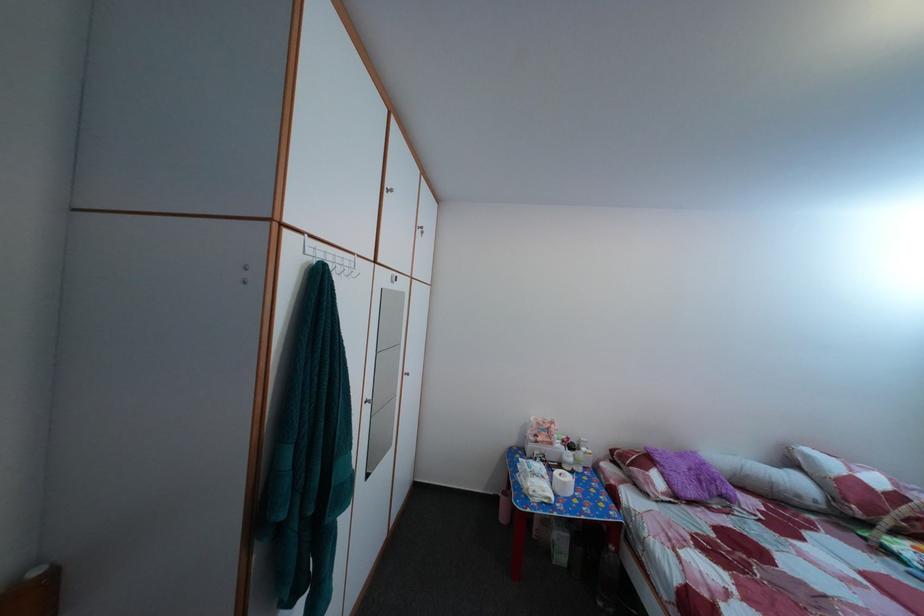
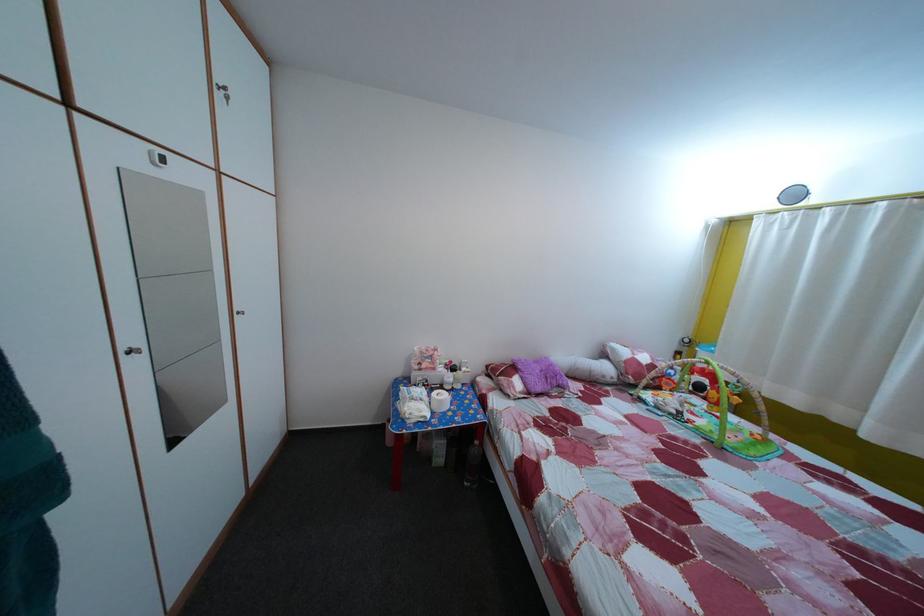
Which direction would the cameraman need to move to produce the second image?

The cameraman moved toward right, forward.